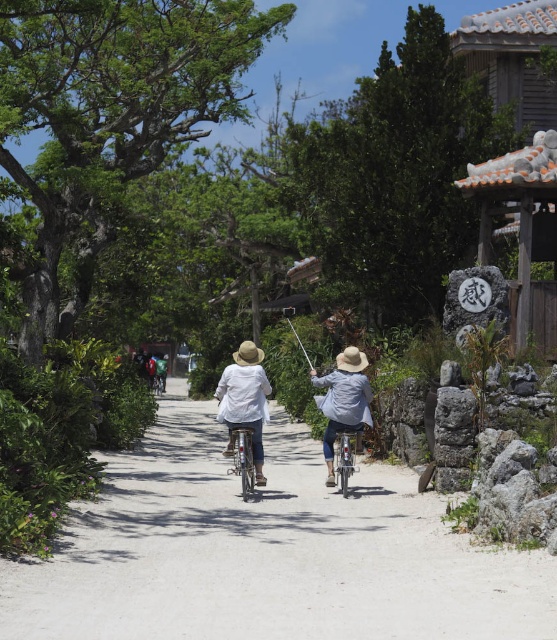
Question: Is white cotton shirt at center bigger than green fabric jacket at center?

Choices:
 (A) no
 (B) yes

Answer: (A)

Question: Does denim jacket at center have a smaller size compared to green fabric jacket at center?

Choices:
 (A) no
 (B) yes

Answer: (B)

Question: Can you confirm if white cotton shirt at center is positioned above metallic silver fishing pole at center?

Choices:
 (A) no
 (B) yes

Answer: (A)

Question: Considering the real-world distances, which object is closest to the metallic silver bicycle at center?

Choices:
 (A) metallic silver fishing pole at center
 (B) white gravel path at center

Answer: (A)

Question: Which of the following is the closest to the observer?

Choices:
 (A) green fabric backpack at center
 (B) white cotton shirt at center
 (C) light blue denim jeans at center

Answer: (B)

Question: Which of the following is the closest to the observer?

Choices:
 (A) light blue denim jeans at center
 (B) white cotton shirt at center
 (C) green fabric jacket at center
 (D) white gravel path at center

Answer: (D)